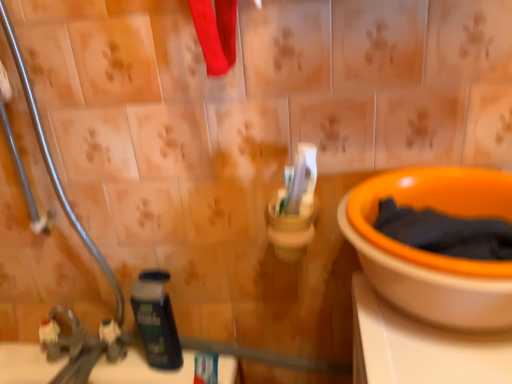
Question: Based on their sizes in the image, would you say metallic silver pipe at left is bigger or smaller than white matte toothpaste at lower center?

Choices:
 (A) big
 (B) small

Answer: (A)

Question: Is metallic silver pipe at left inside the boundaries of white matte toothpaste at lower center, or outside?

Choices:
 (A) inside
 (B) outside

Answer: (B)

Question: Considering the real-world distances, which object is closest to the metallic silver pipe at left?

Choices:
 (A) orange plastic bowl at right
 (B) white matte toothpaste at lower center
 (C) dark blue plastic shaving cream at lower left
 (D) brushed metal faucet at lower left

Answer: (C)

Question: Based on their relative distances, which object is farther from the brushed metal faucet at lower left?

Choices:
 (A) white matte toothpaste at lower center
 (B) metallic silver pipe at left
 (C) orange plastic bowl at right
 (D) dark blue plastic shaving cream at lower left

Answer: (C)